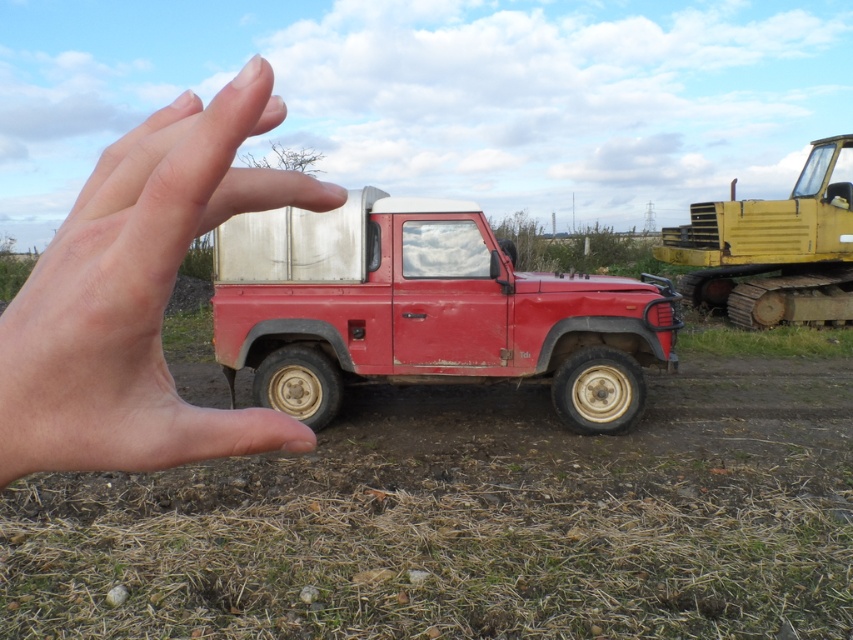
Does rusty metal truck at center have a greater width compared to skinny flesh at center?

Yes.

Is point (483, 275) less distant than point (161, 148)?

No, it is behind (161, 148).

Image resolution: width=853 pixels, height=640 pixels. In order to click on rusty metal truck at center in this screenshot , I will do (x=424, y=310).

Find the location of a particular element. rusty metal truck at center is located at coordinates (424, 310).

Who is shorter, rusty metal truck at center or yellow rubber tracked vehicle at right?

yellow rubber tracked vehicle at right is shorter.

Describe the element at coordinates (424, 310) in the screenshot. I see `rusty metal truck at center` at that location.

Locate an element on the screen. The image size is (853, 640). rusty metal truck at center is located at coordinates (424, 310).

Can you confirm if skinny flesh at center is shorter than yellow rubber tracked vehicle at right?

Indeed, skinny flesh at center has a lesser height compared to yellow rubber tracked vehicle at right.

Does point (55, 413) lie behind point (769, 294)?

No, (55, 413) is in front of (769, 294).

I want to click on skinny flesh at center, so click(138, 296).